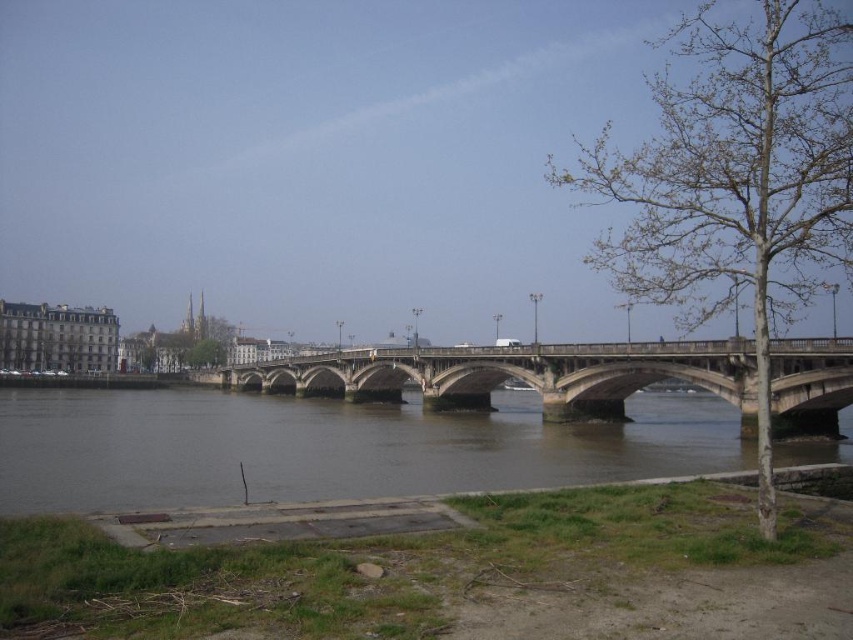
Is bare wood tree at right shorter than green leafy tree at center?

No.

Locate an element on the screen. The width and height of the screenshot is (853, 640). bare wood tree at right is located at coordinates (735, 179).

At what (x,y) coordinates should I click in order to perform the action: click on bare wood tree at right. Please return your answer as a coordinate pair (x, y). Looking at the image, I should click on (735, 179).

Which is more to the right, concrete bridge at center or green leafy tree at center?

From the viewer's perspective, concrete bridge at center appears more on the right side.

Is point (277, 390) positioned in front of point (215, 339)?

Yes, point (277, 390) is in front of point (215, 339).

This screenshot has width=853, height=640. I want to click on concrete bridge at center, so click(x=515, y=374).

The image size is (853, 640). Identify the location of concrete bridge at center. (515, 374).

Who is positioned more to the right, brown muddy water at lower center or green leafy tree at center?

brown muddy water at lower center

Who is more distant from viewer, (635,422) or (209,339)?

Point (209,339)

Which is behind, point (268, 401) or point (206, 368)?

Point (206, 368)

Identify the location of brown muddy water at lower center. (329, 448).